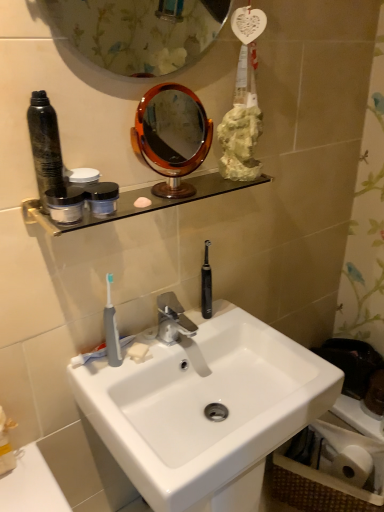
Where is `vacant region below clear glass shelf at upper center (from a real-world perspective)`? This screenshot has height=512, width=384. vacant region below clear glass shelf at upper center (from a real-world perspective) is located at coordinates point(177,338).